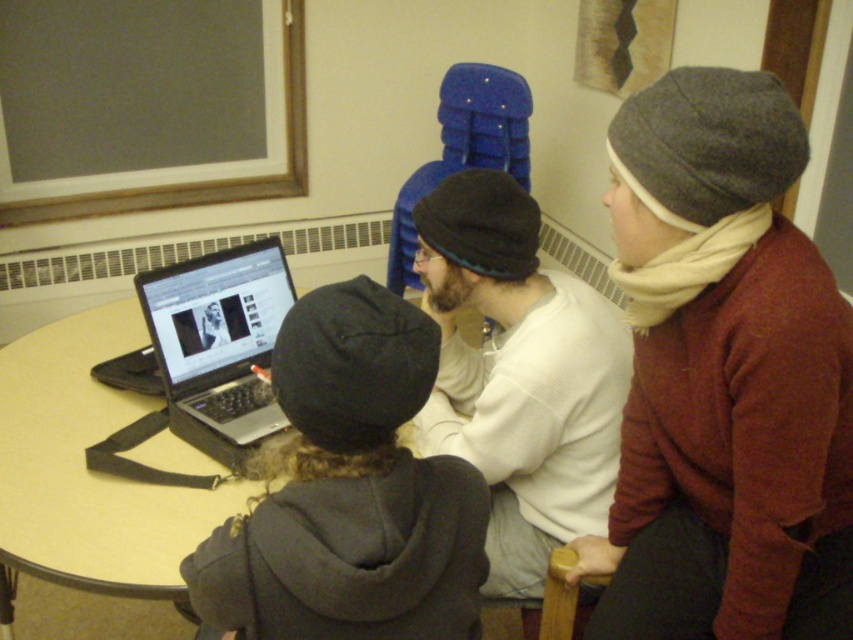
You are standing in front of the round table where three people are working on a laptop. There is a point at coordinates point [643,300]. If you want to reach this point without moving the laptop, which direction should you move relative to your current position?

The point at coordinates point [643,300] is 1.19 meters away from the camera, so you should move forward towards the table to reach it without moving the laptop.

You are a photographer who needs to place a new camera on the table between the dark gray knit beanie at center and the black matte laptop at center. Which object should you move to make space?

The dark gray knit beanie at center is much taller than the black matte laptop at center, so you should move the dark gray knit beanie at center to make space for the camera.

You are a delivery robot with a package that needs to be placed between the gray woolen beanie at upper right and the white cotton shirt at center. The package is 12 inches long. Will it fit in the space between them?

The distance between the gray woolen beanie at upper right and the white cotton shirt at center is 13.37 inches, so the 12 inch package will fit with 1.37 inches of space remaining.